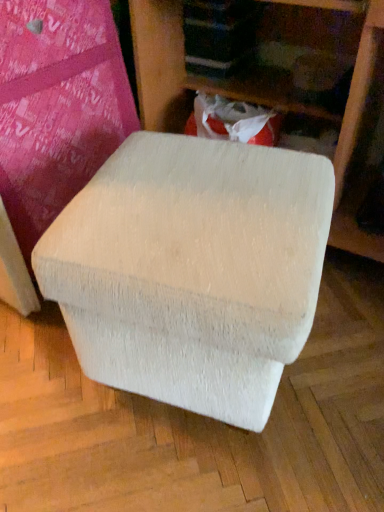
Locate an element on the screen. Image resolution: width=384 pixels, height=512 pixels. vacant point to the right of white textured bean bag at center is located at coordinates pyautogui.click(x=337, y=379).